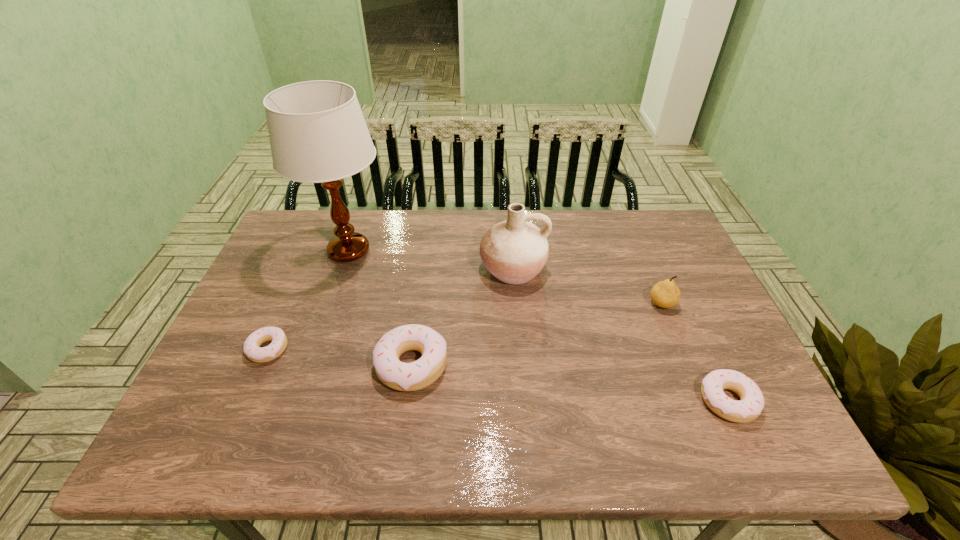
You are a GUI agent. You are given a task and a screenshot of the screen. Output one action in this format:
    pyautogui.click(x=<x>, y=<y>)
    Task: Click on the pottery
    
    Given the screenshot: What is the action you would take?
    pyautogui.click(x=514, y=251)

Locate an element on the screen. This screenshot has height=540, width=960. vacant space located on the front of the shortest object is located at coordinates (241, 410).

Where is `vacant region located on the left of the third shortest object`? The height and width of the screenshot is (540, 960). vacant region located on the left of the third shortest object is located at coordinates (221, 365).

Identify the location of vacant area situated on the left of the rightmost doughnut. (615, 401).

The width and height of the screenshot is (960, 540). I want to click on vacant space situated on the front of the tallest object, so click(303, 387).

The image size is (960, 540). I want to click on vacant space located on the left of the fourth shortest object, so click(601, 303).

What are the coordinates of `vacant space located to pour from the handle of the pottery` in the screenshot? It's located at (524, 412).

Where is `table lamp at the far edge`? This screenshot has height=540, width=960. table lamp at the far edge is located at coordinates (317, 132).

At what (x,y) coordinates should I click in order to perform the action: click on pottery at the far edge. Please return your answer as a coordinate pair (x, y). This screenshot has width=960, height=540. Looking at the image, I should click on (514, 251).

Where is `doughnut that is at the left edge`? This screenshot has width=960, height=540. doughnut that is at the left edge is located at coordinates (252, 350).